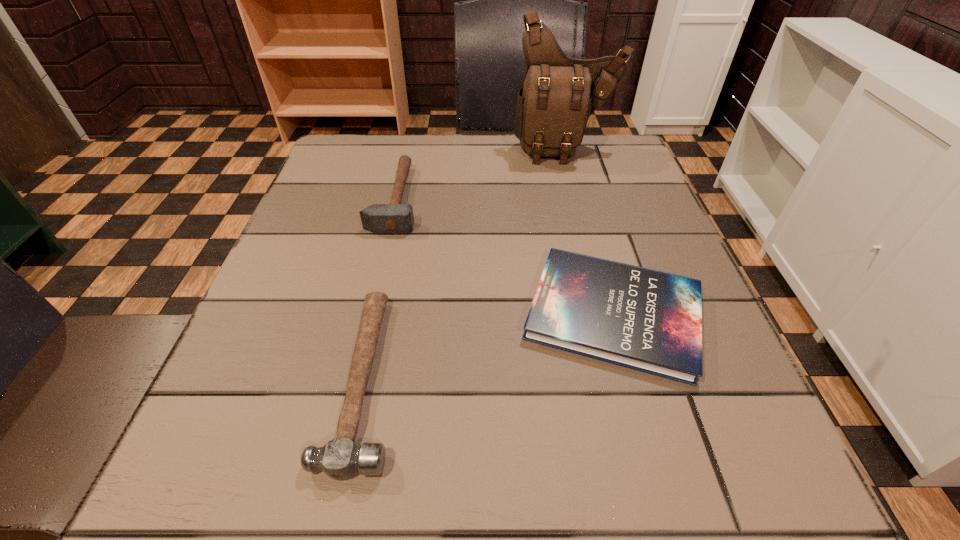
The height and width of the screenshot is (540, 960). Find the location of `unoccupied position between the shoulder bag and the farther hammer`. unoccupied position between the shoulder bag and the farther hammer is located at coordinates (480, 174).

The image size is (960, 540). I want to click on free space between the shorter hammer and the second tallest object, so click(380, 288).

You are a GUI agent. You are given a task and a screenshot of the screen. Output one action in this format:
    pyautogui.click(x=<x>, y=<y>)
    Task: Click on the free area in between the shortest object and the shoulder bag
    The width and height of the screenshot is (960, 540).
    Given the screenshot: What is the action you would take?
    pyautogui.click(x=589, y=231)

You are a GUI agent. You are given a task and a screenshot of the screen. Output one action in this format:
    pyautogui.click(x=<x>, y=<y>)
    Task: Click on the free space that is in between the nearer hammer and the second tallest object
    
    Given the screenshot: What is the action you would take?
    pyautogui.click(x=380, y=288)

At what (x,y) coordinates should I click in order to perform the action: click on unoccupied position between the shortest object and the shorter hammer. Please return your answer as a coordinate pair (x, y). The image size is (960, 540). Looking at the image, I should click on coord(489,346).

Where is `vacant point located between the hardback book and the nearer hammer`? vacant point located between the hardback book and the nearer hammer is located at coordinates (489, 346).

Where is `the second closest object relative to the second shortest object`? The image size is (960, 540). the second closest object relative to the second shortest object is located at coordinates (643, 319).

Select which object appears as the third closest to the nearer hammer. Please provide its 2D coordinates. Your answer should be formatted as a tuple, i.e. [(x, y)], where the tuple contains the x and y coordinates of a point satisfying the conditions above.

[(558, 95)]

You are a GUI agent. You are given a task and a screenshot of the screen. Output one action in this format:
    pyautogui.click(x=<x>, y=<y>)
    Task: Click on the vacant space that satisfies the following two spatial constraints: 1. on the back side of the hardback book; 2. on the striking surface of the third nearest object
    This screenshot has height=540, width=960.
    Given the screenshot: What is the action you would take?
    pyautogui.click(x=582, y=198)

I want to click on blank space that satisfies the following two spatial constraints: 1. on the back side of the shortest object; 2. on the striking surface of the third shortest object, so click(x=582, y=198).